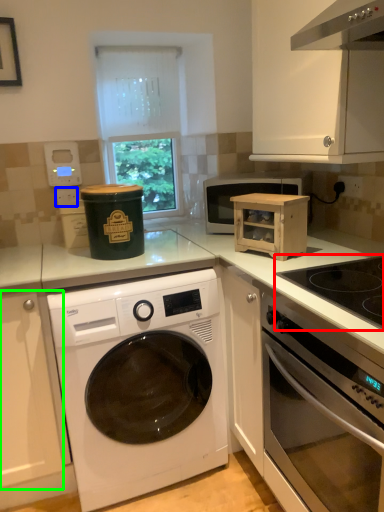
Question: Which is farther away from gas stove (highlighted by a red box)? electric outlet (highlighted by a blue box) or cabinetry (highlighted by a green box)?

Choices:
 (A) electric outlet
 (B) cabinetry

Answer: (A)